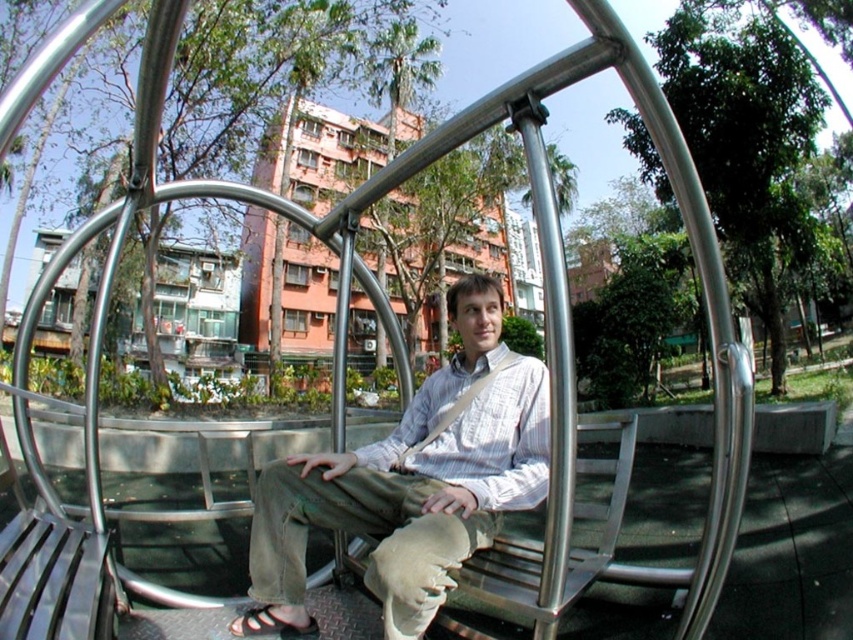
Image resolution: width=853 pixels, height=640 pixels. What are the coordinates of `black leather sandal at lower center` in the screenshot? It's located at pyautogui.click(x=270, y=625).

Who is shorter, black leather sandal at lower center or white fabric strap at center?

With less height is black leather sandal at lower center.

This screenshot has width=853, height=640. I want to click on black leather sandal at lower center, so click(x=270, y=625).

Measure the distance between light brown cotton pants at center and camera.

3.83 feet

Is light brown cotton pants at center thinner than black leather sandal at lower center?

No, light brown cotton pants at center is not thinner than black leather sandal at lower center.

The width and height of the screenshot is (853, 640). What do you see at coordinates (416, 477) in the screenshot? I see `light brown cotton pants at center` at bounding box center [416, 477].

You are a GUI agent. You are given a task and a screenshot of the screen. Output one action in this format:
    pyautogui.click(x=<x>, y=<y>)
    Task: Click on the light brown cotton pants at center
    
    Given the screenshot: What is the action you would take?
    pyautogui.click(x=416, y=477)

Which is more to the left, light brown cotton pants at center or white fabric strap at center?

light brown cotton pants at center

Does light brown cotton pants at center appear over white fabric strap at center?

Incorrect, light brown cotton pants at center is not positioned above white fabric strap at center.

Is point (380, 509) positioned in front of point (496, 365)?

Yes, point (380, 509) is closer to viewer.

Locate an element on the screen. The image size is (853, 640). light brown cotton pants at center is located at coordinates (416, 477).